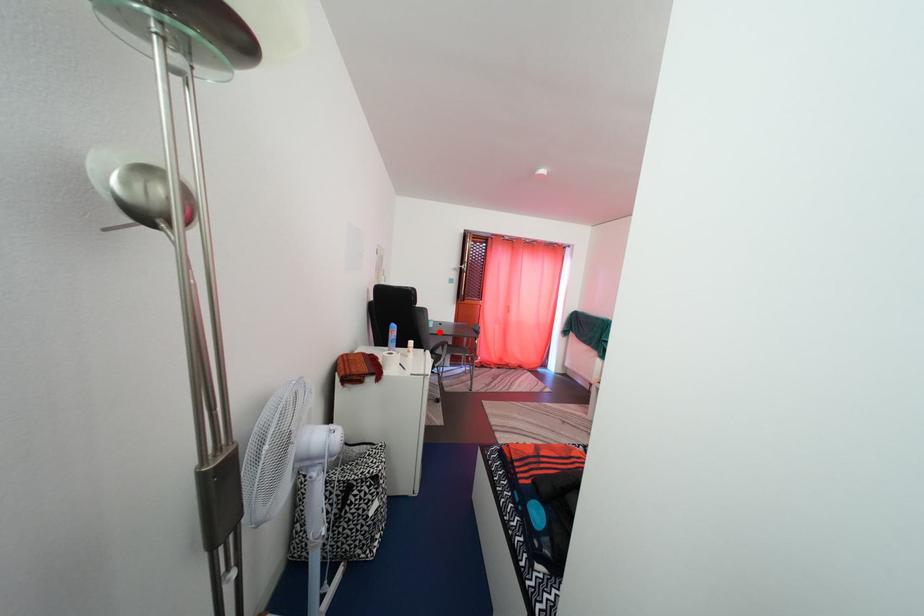
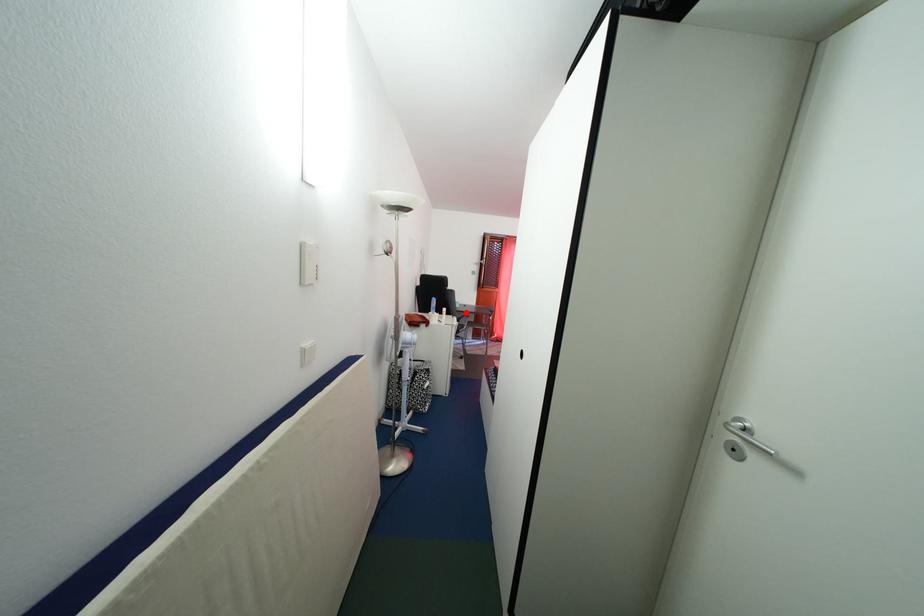
I am providing you with two images of the same scene from different viewpoints. A red point is marked on the first image and another point is marked on the second image. Do the highlighted points in image1 and image2 indicate the same real-world spot?

Yes